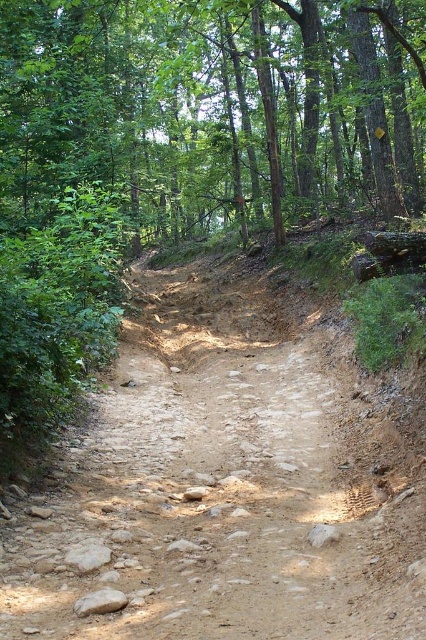
You are a hiker who wants to step onto the brown dirt track at center. You notice a gray rough rock at lower left nearby. Which object is higher in elevation?

The brown dirt track at center is taller than the gray rough rock at lower left, so the brown dirt track at center has a higher elevation.

You are standing at the starting point of the dirt trail in the forest. You want to find the green leafy tree at upper center. According to the coordinates given, where should you look relative to your position?

The green leafy tree at upper center is located at coordinates 0.166 on the x axis and 0.491 on the y axis, so you should look towards the upper center direction from your current position on the dirt trail.